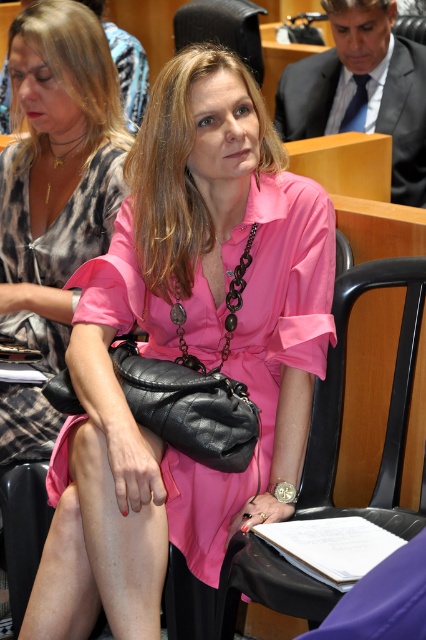
Does matte black purse at center have a larger size compared to pink satin dress at center?

Yes, matte black purse at center is bigger than pink satin dress at center.

Which is above, matte black purse at center or pink satin dress at center?

pink satin dress at center is above.

Between point (328, 262) and point (120, 154), which one is positioned behind?

The point (120, 154) is more distant.

At what (x,y) coordinates should I click in order to perform the action: click on matte black purse at center. Please return your answer as a coordinate pair (x, y). The width and height of the screenshot is (426, 640). Looking at the image, I should click on (189, 349).

Between matte black purse at center and black leather chair at center, which one appears on the left side from the viewer's perspective?

matte black purse at center

Consider the image. Does matte black purse at center have a greater height compared to black leather chair at center?

Yes, matte black purse at center is taller than black leather chair at center.

You are a GUI agent. You are given a task and a screenshot of the screen. Output one action in this format:
    pyautogui.click(x=<x>, y=<y>)
    Task: Click on the matte black purse at center
    
    Given the screenshot: What is the action you would take?
    pyautogui.click(x=189, y=349)

Is black leather chair at center taller than pink satin dress at center?

In fact, black leather chair at center may be shorter than pink satin dress at center.

Which of these two, black leather chair at center or pink satin dress at center, stands taller?

pink satin dress at center is taller.

Is point (394, 284) positioned before point (103, 241)?

Yes.

The width and height of the screenshot is (426, 640). In order to click on black leather chair at center in this screenshot , I will do `click(342, 403)`.